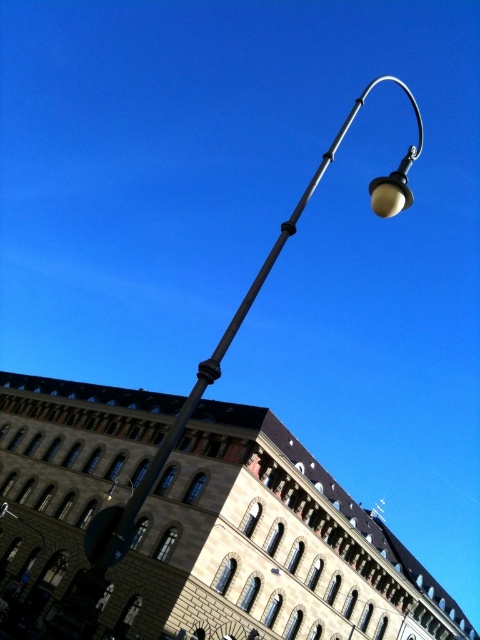
You are a city planner reviewing the street layout. You notice two objects labeled matte black street light at upper center and matte black streetlamp at upper center. Which one is taller?

The matte black street light at upper center is much taller than the matte black streetlamp at upper center.

You are standing on the street looking at the building and the streetlamp. There are two points marked on the image. Which point is closer to you, point [365,93] or point [126,484]?

Point [365,93] is closer to you because it is further to the viewer than point [126,484].

You are standing on the street and see the matte black street light at upper center and the matte black streetlamp at upper center. Which one is positioned to the right?

The matte black street light at upper center is positioned to the right of the matte black streetlamp at upper center.